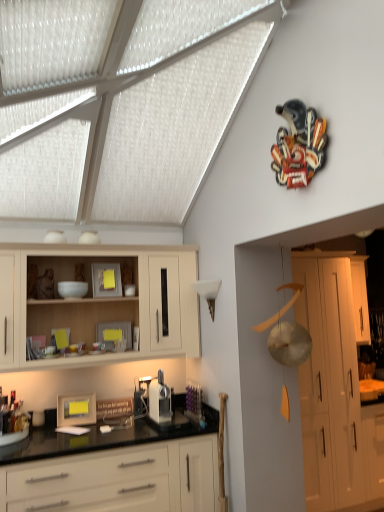
Question: Considering the relative sizes of light wood cabinet at upper left, which appears as the 1th cabinetry when viewed from the left, and white matte cabinet at right, the third cabinetry viewed from the left, in the image provided, is light wood cabinet at upper left, which appears as the 1th cabinetry when viewed from the left, smaller than white matte cabinet at right, the third cabinetry viewed from the left,?

Choices:
 (A) yes
 (B) no

Answer: (A)

Question: From the image's perspective, is light wood cabinet at upper left, which appears as the 1th cabinetry when viewed from the left, over white matte cabinet at right, which is the second cabinetry from right to left?

Choices:
 (A) no
 (B) yes

Answer: (B)

Question: Considering the relative sizes of light wood cabinet at upper left, which appears as the 1th cabinetry when viewed from the left, and white matte cabinet at right, which is the second cabinetry from right to left, in the image provided, is light wood cabinet at upper left, which appears as the 1th cabinetry when viewed from the left, thinner than white matte cabinet at right, which is the second cabinetry from right to left,?

Choices:
 (A) yes
 (B) no

Answer: (A)

Question: Is light wood cabinet at upper left, acting as the 4th cabinetry starting from the right, touching white matte cabinet at right, the third cabinetry viewed from the left?

Choices:
 (A) no
 (B) yes

Answer: (A)

Question: Would you say light wood cabinet at upper left, acting as the 4th cabinetry starting from the right, contains white matte cabinet at right, which is the second cabinetry from right to left?

Choices:
 (A) no
 (B) yes

Answer: (A)

Question: From their relative heights in the image, would you say white matte cabinet at right, the third cabinetry viewed from the left, is taller or shorter than white glossy cabinets at lower center, marked as the third cabinetry in a right-to-left arrangement?

Choices:
 (A) tall
 (B) short

Answer: (A)

Question: Looking at their shapes, would you say white matte cabinet at right, which is the second cabinetry from right to left, is wider or thinner than white glossy cabinets at lower center, the second cabinetry from the left?

Choices:
 (A) thin
 (B) wide

Answer: (B)

Question: Based on their positions, is white matte cabinet at right, which is the second cabinetry from right to left, located to the left or right of white glossy cabinets at lower center, the second cabinetry from the left?

Choices:
 (A) left
 (B) right

Answer: (B)

Question: Considering their positions, is white matte cabinet at right, the third cabinetry viewed from the left, located in front of or behind white glossy cabinets at lower center, the second cabinetry from the left?

Choices:
 (A) front
 (B) behind

Answer: (B)

Question: Relative to white matte cabinet at right, which is the second cabinetry from right to left, is light wood cabinet at upper left, acting as the 4th cabinetry starting from the right, in front or behind?

Choices:
 (A) front
 (B) behind

Answer: (A)

Question: From a real-world perspective, is light wood cabinet at upper left, acting as the 4th cabinetry starting from the right, positioned above or below white matte cabinet at right, which is the second cabinetry from right to left?

Choices:
 (A) below
 (B) above

Answer: (B)

Question: Is light wood cabinet at upper left, which appears as the 1th cabinetry when viewed from the left, inside or outside of white matte cabinet at right, which is the second cabinetry from right to left?

Choices:
 (A) outside
 (B) inside

Answer: (A)

Question: Visually, is light wood cabinet at upper left, acting as the 4th cabinetry starting from the right, positioned to the left or to the right of white matte cabinet at right, which is the second cabinetry from right to left?

Choices:
 (A) right
 (B) left

Answer: (B)

Question: Considering the relative positions of white glossy cabinets at lower center, marked as the third cabinetry in a right-to-left arrangement, and white glossy cabinet at right, positioned as the 4th cabinetry in left-to-right order, in the image provided, is white glossy cabinets at lower center, marked as the third cabinetry in a right-to-left arrangement, to the left or to the right of white glossy cabinet at right, positioned as the 4th cabinetry in left-to-right order,?

Choices:
 (A) left
 (B) right

Answer: (A)

Question: Is white glossy cabinets at lower center, marked as the third cabinetry in a right-to-left arrangement, wider or thinner than white glossy cabinet at right, which is the 1th cabinetry in right-to-left order?

Choices:
 (A) thin
 (B) wide

Answer: (B)